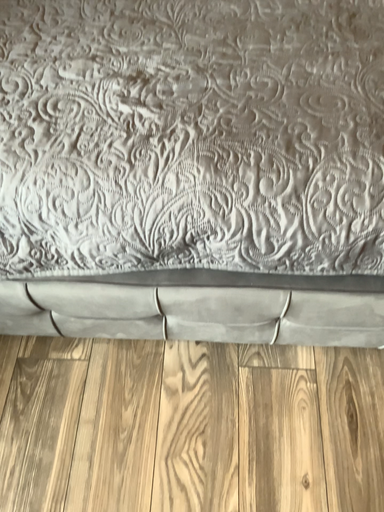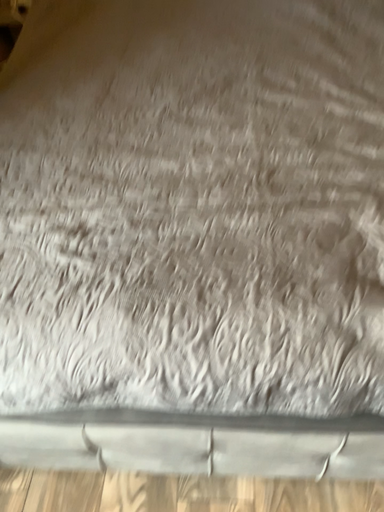
Question: How did the camera likely rotate when shooting the video?

Choices:
 (A) rotated downward
 (B) rotated upward

Answer: (B)